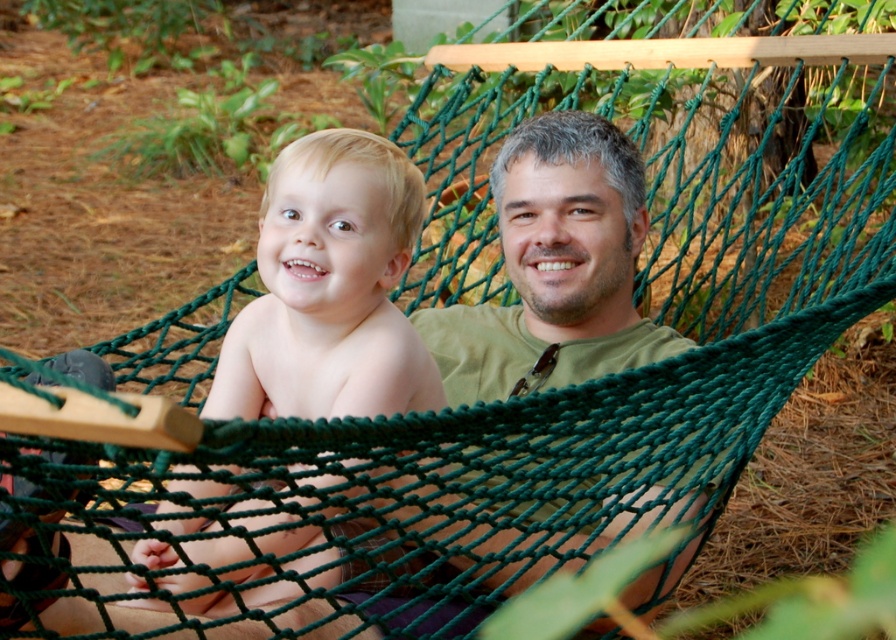
Can you confirm if green fabric hammock at center is taller than blonde hair baby at center?

Correct, green fabric hammock at center is much taller as blonde hair baby at center.

Is green fabric hammock at center further to the viewer compared to blonde hair baby at center?

No.

What do you see at coordinates (453, 305) in the screenshot? The width and height of the screenshot is (896, 640). I see `green fabric hammock at center` at bounding box center [453, 305].

Where is `green fabric hammock at center`? Image resolution: width=896 pixels, height=640 pixels. green fabric hammock at center is located at coordinates tap(453, 305).